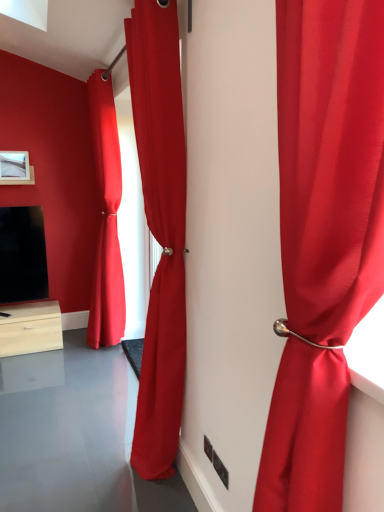
Where is `vacant space in front of satin red curtain at center, the 2th curtain viewed from the back`? The width and height of the screenshot is (384, 512). vacant space in front of satin red curtain at center, the 2th curtain viewed from the back is located at coordinates (138, 497).